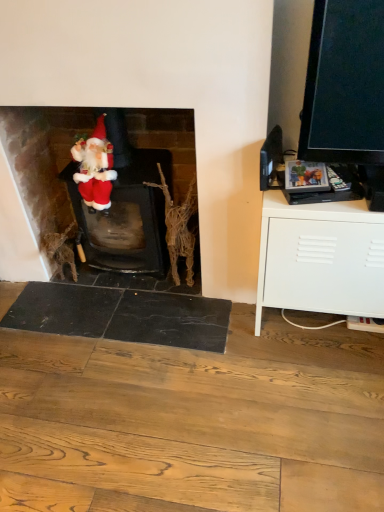
Question: Does velvet red santa at center come in front of white matte cabinet at right?

Choices:
 (A) yes
 (B) no

Answer: (B)

Question: From a real-world perspective, does velvet red santa at center sit lower than white matte cabinet at right?

Choices:
 (A) yes
 (B) no

Answer: (B)

Question: Is velvet red santa at center completely or partially outside of white matte cabinet at right?

Choices:
 (A) yes
 (B) no

Answer: (A)

Question: Is velvet red santa at center to the right of white matte cabinet at right from the viewer's perspective?

Choices:
 (A) yes
 (B) no

Answer: (B)

Question: Is velvet red santa at center wider than white matte cabinet at right?

Choices:
 (A) no
 (B) yes

Answer: (A)

Question: Which is correct: velvet red santa at center is inside bark-like textured branch at center, or outside of it?

Choices:
 (A) inside
 (B) outside

Answer: (B)

Question: From the image's perspective, relative to bark-like textured branch at center, is velvet red santa at center above or below?

Choices:
 (A) below
 (B) above

Answer: (B)

Question: In terms of height, does velvet red santa at center look taller or shorter compared to bark-like textured branch at center?

Choices:
 (A) short
 (B) tall

Answer: (B)

Question: From a real-world perspective, relative to bark-like textured branch at center, is velvet red santa at center vertically above or below?

Choices:
 (A) below
 (B) above

Answer: (B)

Question: From the image's perspective, is matte red santa at left positioned above or below bark-like textured branch at center?

Choices:
 (A) above
 (B) below

Answer: (A)

Question: Does point (92, 194) appear closer or farther from the camera than point (190, 192)?

Choices:
 (A) farther
 (B) closer

Answer: (B)

Question: From a real-world perspective, is matte red santa at left physically located above or below bark-like textured branch at center?

Choices:
 (A) below
 (B) above

Answer: (B)

Question: In terms of size, does matte red santa at left appear bigger or smaller than bark-like textured branch at center?

Choices:
 (A) small
 (B) big

Answer: (A)

Question: From a real-world perspective, is matte red santa at left above or below white matte cabinet at right?

Choices:
 (A) above
 (B) below

Answer: (A)

Question: Considering the positions of point (100, 185) and point (339, 215), is point (100, 185) closer or farther from the camera than point (339, 215)?

Choices:
 (A) farther
 (B) closer

Answer: (A)